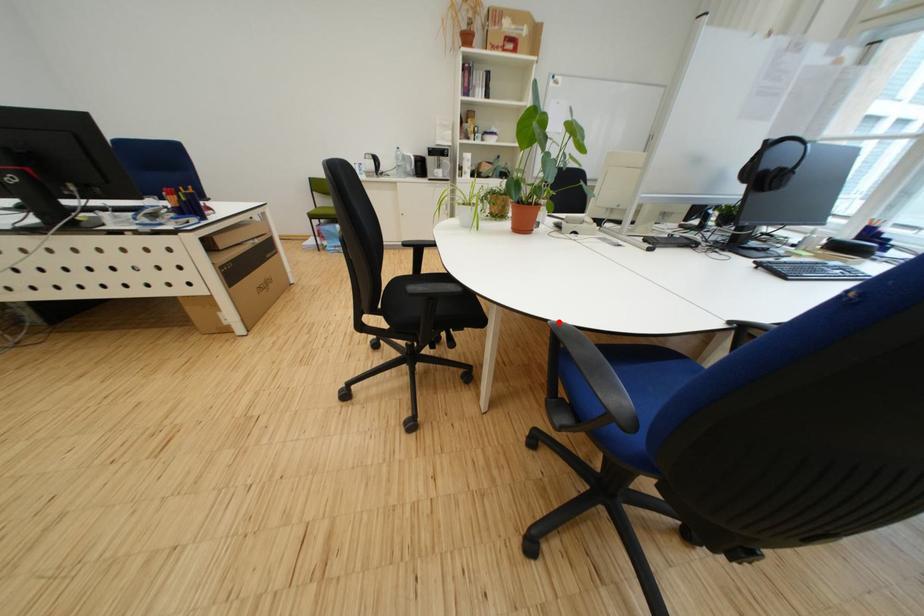
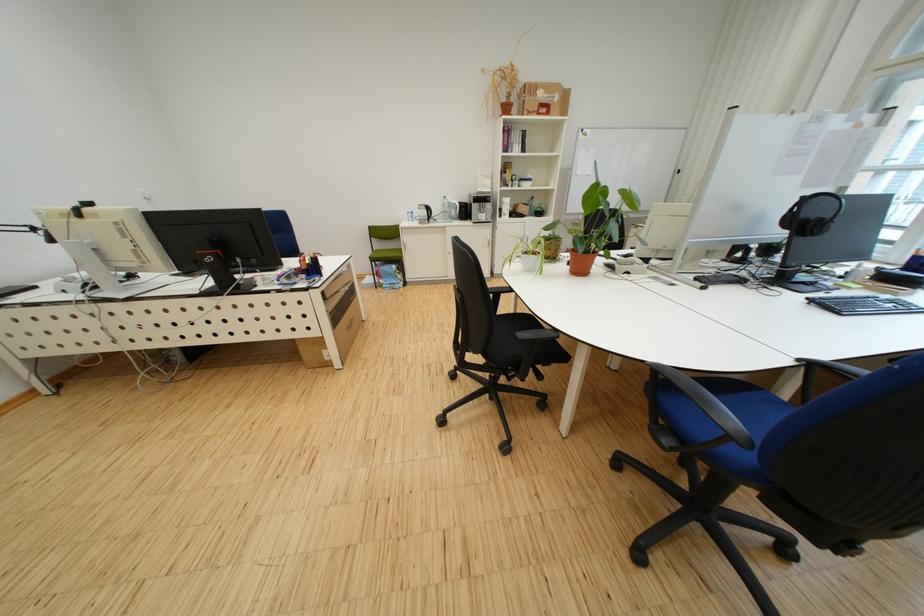
Where in the second image is the point corresponding to the highlighted location from the first image?

(655, 363)